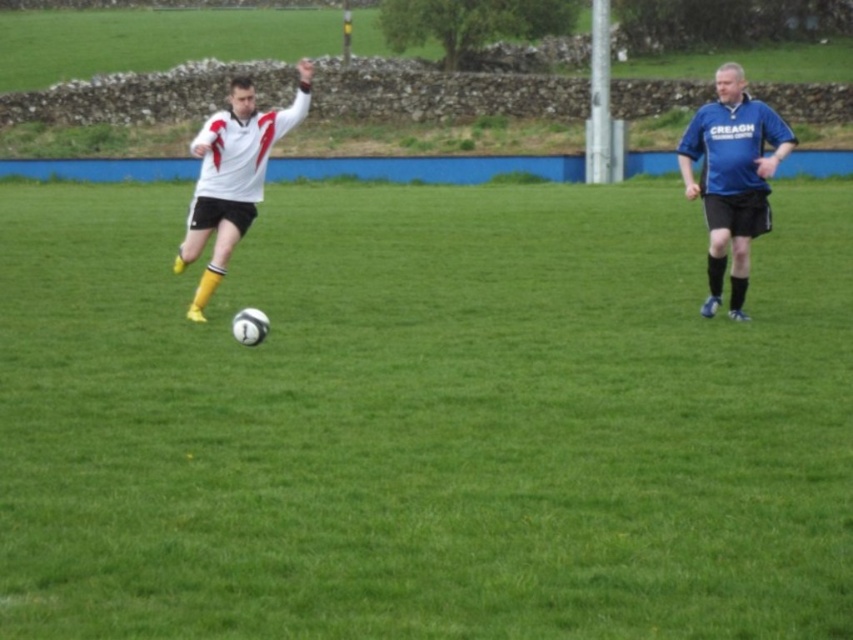
This screenshot has width=853, height=640. Describe the element at coordinates (424, 419) in the screenshot. I see `white matte soccer ball at center` at that location.

Looking at this image, who is shorter, white matte soccer ball at center or white matte jersey at center?

white matte soccer ball at center is shorter.

Locate an element on the screen. white matte soccer ball at center is located at coordinates (424, 419).

Does point (747, 106) lie behind point (225, 221)?

No, it is not.

Which of these two, blue jersey at right or white matte jersey at center, stands taller?

white matte jersey at center is taller.

Identify the location of blue jersey at right. click(732, 177).

Is point (647, 378) positioned before point (773, 113)?

That is True.

You are a GUI agent. You are given a task and a screenshot of the screen. Output one action in this format:
    pyautogui.click(x=<x>, y=<y>)
    Task: Click on the white matte soccer ball at center
    This screenshot has height=640, width=853.
    Given the screenshot: What is the action you would take?
    pyautogui.click(x=424, y=419)